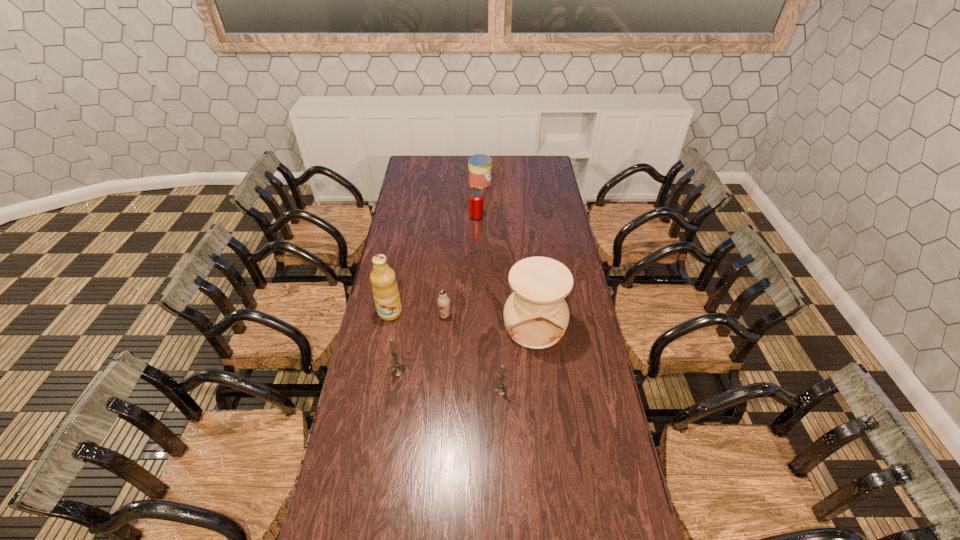
The width and height of the screenshot is (960, 540). I want to click on empty location between the nearer can and the nearest object, so click(x=489, y=303).

I want to click on vacant point located between the farther can and the fifth object from right to left, so click(x=463, y=249).

Where is `empty space between the olive oil and the third object from left to right`? empty space between the olive oil and the third object from left to right is located at coordinates (418, 314).

Where is `vacant space that's between the farthest object and the shorter candle`? The image size is (960, 540). vacant space that's between the farthest object and the shorter candle is located at coordinates (491, 286).

Identify the location of vacant space that is in between the nearest object and the pottery. (517, 358).

At what (x,y) coordinates should I click in order to perform the action: click on object that is the fourth closest to the chocolate milk. Please return your answer as a coordinate pair (x, y). The width and height of the screenshot is (960, 540). Looking at the image, I should click on (501, 389).

Locate which object ranks third in proximity to the right candle. Please provide its 2D coordinates. Your answer should be formatted as a tuple, i.e. [(x, y)], where the tuple contains the x and y coordinates of a point satisfying the conditions above.

[(443, 301)]

Where is `free spot that satisfies the following two spatial constraints: 1. on the label of the olive oil; 2. on the left side of the nearer candle`? The width and height of the screenshot is (960, 540). free spot that satisfies the following two spatial constraints: 1. on the label of the olive oil; 2. on the left side of the nearer candle is located at coordinates (375, 390).

Where is `free spot that satisfies the following two spatial constraints: 1. on the label of the third tallest object; 2. on the right side of the olive oil`? free spot that satisfies the following two spatial constraints: 1. on the label of the third tallest object; 2. on the right side of the olive oil is located at coordinates (379, 370).

You are a GUI agent. You are given a task and a screenshot of the screen. Output one action in this format:
    pyautogui.click(x=<x>, y=<y>)
    Task: Click on the vacant space that satisfies the following two spatial constraints: 1. on the front side of the nearer candle; 2. on the left side of the third object from left to right
    The width and height of the screenshot is (960, 540).
    Given the screenshot: What is the action you would take?
    [439, 390]